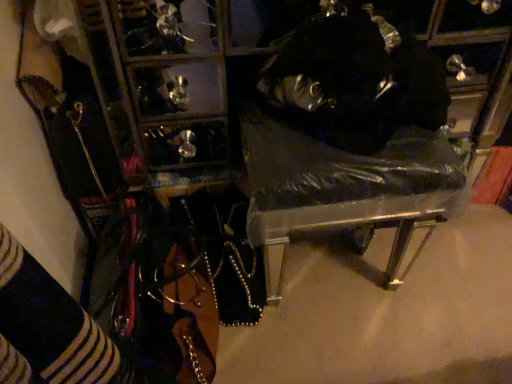
Question: Is point (340, 127) closer or farther from the camera than point (305, 49)?

Choices:
 (A) farther
 (B) closer

Answer: (A)

Question: Considering the positions of clear plastic bag at center and fuzzy black hat at upper right in the image, is clear plastic bag at center wider or thinner than fuzzy black hat at upper right?

Choices:
 (A) wide
 (B) thin

Answer: (A)

Question: Is clear plastic bag at center bigger or smaller than fuzzy black hat at upper right?

Choices:
 (A) small
 (B) big

Answer: (B)

Question: From the image's perspective, relative to clear plastic bag at center, is fuzzy black hat at upper right above or below?

Choices:
 (A) above
 (B) below

Answer: (A)

Question: In terms of width, does fuzzy black hat at upper right look wider or thinner when compared to clear plastic bag at center?

Choices:
 (A) thin
 (B) wide

Answer: (A)

Question: From their relative heights in the image, would you say fuzzy black hat at upper right is taller or shorter than clear plastic bag at center?

Choices:
 (A) tall
 (B) short

Answer: (B)

Question: In the image, is fuzzy black hat at upper right on the left side or the right side of clear plastic bag at center?

Choices:
 (A) right
 (B) left

Answer: (A)